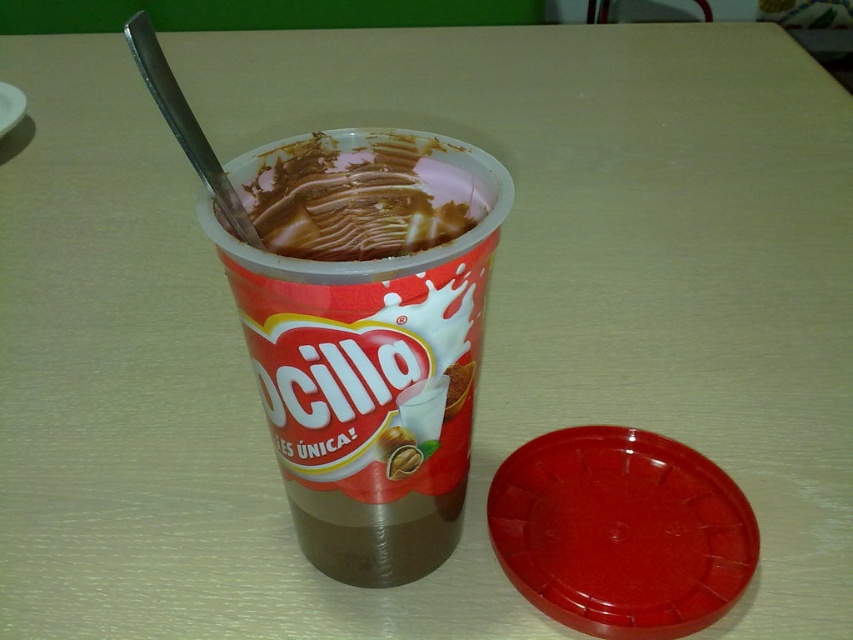
You are at a dessert shop and want to order an ice cream. The menu shows a brown matte plastic cup at center and a chocolate creamy ice cream at center. According to the menu, which item is placed higher?

The chocolate creamy ice cream at center is placed higher than the brown matte plastic cup at center.

You are standing at the origin point of the coordinate system. Where is the brown matte plastic cup at center located?

The brown matte plastic cup at center is located at point (367, 333).

You are at a dessert shop and want to know which item is bigger between the brown matte plastic cup at center and the chocolate creamy ice cream at center. Which one is bigger?

The brown matte plastic cup at center is larger in size than the chocolate creamy ice cream at center.